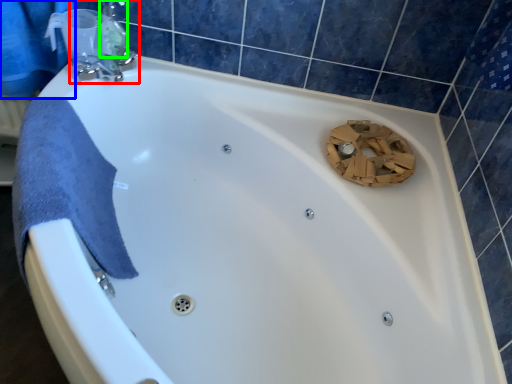
Question: Which is nearer to the tap (highlighted by a red box)? shower curtain (highlighted by a blue box) or toiletry (highlighted by a green box).

Choices:
 (A) shower curtain
 (B) toiletry

Answer: (B)